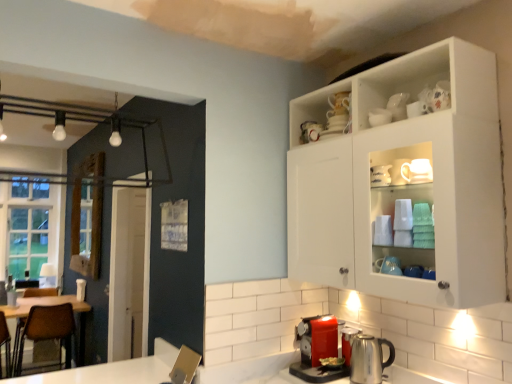
The width and height of the screenshot is (512, 384). I want to click on clear glass window at left, so click(31, 225).

Identify the location of metallic silver kettle at lower center. (369, 359).

What are the coordinates of `white ceramic mug at upper center, the 1th tableware from the left` in the screenshot? It's located at (379, 117).

At what (x,y) coordinates should I click in order to perform the action: click on white glossy cabinet at upper right. Please return your answer as a coordinate pair (x, y). Image resolution: width=512 pixels, height=384 pixels. Looking at the image, I should click on (409, 158).

This screenshot has width=512, height=384. What do you see at coordinates (47, 332) in the screenshot?
I see `brown leather chair at left` at bounding box center [47, 332].

At what (x,y) coordinates should I click in order to perform the action: click on clear glass window at left. Please return your answer as a coordinate pair (x, y). The width and height of the screenshot is (512, 384). Looking at the image, I should click on (31, 225).

In the scene shown: From the image's perspective, which one is positioned lower, brown leather chair at left or white glossy mug at upper center, the first tableware viewed from the right?

From the image's view, brown leather chair at left is below.

Is brown leather chair at left aimed at white glossy mug at upper center, arranged as the 1th tableware when viewed from the top?

No, brown leather chair at left is not facing towards white glossy mug at upper center, arranged as the 1th tableware when viewed from the top.

From a real-world perspective, who is located lower, brown leather chair at left or white glossy mug at upper center, arranged as the 2th tableware when viewed from the left?

brown leather chair at left.

Can you confirm if brown leather chair at left is taller than white glossy mug at upper center, the first tableware viewed from the right?

Indeed, brown leather chair at left has a greater height compared to white glossy mug at upper center, the first tableware viewed from the right.

Does point (399, 113) appear closer or farther from the camera than point (380, 348)?

Point (399, 113) appears to be closer to the viewer than point (380, 348).

Starting from the metallic silver kettle at lower center, which tableware is the 2nd one to the right? Please provide its 2D coordinates.

[(398, 106)]

Considering the sizes of objects white glossy mug at upper center, arranged as the 2th tableware when viewed from the left, and metallic silver kettle at lower center in the image provided, who is bigger, white glossy mug at upper center, arranged as the 2th tableware when viewed from the left, or metallic silver kettle at lower center?

metallic silver kettle at lower center.

How different are the orientations of white glossy mug at upper center, the first tableware viewed from the right, and clear glass window at left in degrees?

The angle between the facing direction of white glossy mug at upper center, the first tableware viewed from the right, and the facing direction of clear glass window at left is 89.5 degrees.

Is the surface of white glossy mug at upper center, acting as the 2th tableware starting from the front, in direct contact with clear glass window at left?

No, white glossy mug at upper center, acting as the 2th tableware starting from the front, is not beside clear glass window at left.

Does white glossy mug at upper center, acting as the second tableware starting from the bottom, have a larger size compared to clear glass window at left?

No.

Is white glossy mug at upper center, acting as the second tableware starting from the bottom, taller or shorter than clear glass window at left?

In the image, white glossy mug at upper center, acting as the second tableware starting from the bottom, appears to be shorter than clear glass window at left.

Do you think white ceramic mug at upper center, the 1th tableware when ordered from front to back, is within white glossy cabinet at upper right, or outside of it?

white ceramic mug at upper center, the 1th tableware when ordered from front to back, is located inside white glossy cabinet at upper right.

Based on the photo, from a real-world perspective, which is physically below, white ceramic mug at upper center, the 1th tableware when ordered from front to back, or white glossy cabinet at upper right?

white glossy cabinet at upper right.

Does white ceramic mug at upper center, marked as the 1th tableware in a bottom-to-top arrangement, turn towards white glossy cabinet at upper right?

Yes, white ceramic mug at upper center, marked as the 1th tableware in a bottom-to-top arrangement, faces towards white glossy cabinet at upper right.

From the image's perspective, which one is positioned higher, white glossy cabinet at upper right or brown leather chair at left?

→ white glossy cabinet at upper right is shown above in the image.

Is white glossy cabinet at upper right smaller than brown leather chair at left?

No, white glossy cabinet at upper right is not smaller than brown leather chair at left.

From a real-world perspective, is white glossy cabinet at upper right physically above brown leather chair at left?

Indeed, from a real-world perspective, white glossy cabinet at upper right stands above brown leather chair at left.

Considering the relative positions of white glossy mug at upper center, the first tableware viewed from the right, and brown leather chair at left in the image provided, is white glossy mug at upper center, the first tableware viewed from the right, behind brown leather chair at left?

No.

Between white glossy mug at upper center, arranged as the 2th tableware when viewed from the left, and brown leather chair at left, which one appears on the right side from the viewer's perspective?

Positioned to the right is white glossy mug at upper center, arranged as the 2th tableware when viewed from the left.

From the image's perspective, is white glossy mug at upper center, acting as the second tableware starting from the bottom, under brown leather chair at left?

Incorrect, from the image's perspective, white glossy mug at upper center, acting as the second tableware starting from the bottom, is higher than brown leather chair at left.

How much distance is there between white glossy mug at upper center, which is counted as the 1th tableware, starting from the back, and brown leather chair at left?

A distance of 11.22 feet exists between white glossy mug at upper center, which is counted as the 1th tableware, starting from the back, and brown leather chair at left.

Considering the sizes of metallic silver kettle at lower center and white glossy mug at upper center, which is counted as the 1th tableware, starting from the back, in the image, is metallic silver kettle at lower center wider or thinner than white glossy mug at upper center, which is counted as the 1th tableware, starting from the back,?

Clearly, metallic silver kettle at lower center has more width compared to white glossy mug at upper center, which is counted as the 1th tableware, starting from the back.

Which is closer, (377, 381) or (402, 115)?

Point (377, 381).

Which object is positioned more to the right, metallic silver kettle at lower center or white glossy mug at upper center, acting as the 2th tableware starting from the front?

white glossy mug at upper center, acting as the 2th tableware starting from the front, is more to the right.

Is metallic silver kettle at lower center surrounding white glossy mug at upper center, arranged as the 1th tableware when viewed from the top?

No, white glossy mug at upper center, arranged as the 1th tableware when viewed from the top, is not inside metallic silver kettle at lower center.

This screenshot has height=384, width=512. In order to click on chair on the left of white glossy mug at upper center, arranged as the 1th tableware when viewed from the top in this screenshot , I will do (x=47, y=332).

This screenshot has height=384, width=512. In order to click on tableware that is the 2nd object located above the metallic silver kettle at lower center (from the image's perspective) in this screenshot , I will do `click(398, 106)`.

From the image, which object appears to be farther from white ceramic mug at upper center, acting as the second tableware starting from the right, white glossy cabinet at upper right or clear glass window at left?

Based on the image, clear glass window at left appears to be further to white ceramic mug at upper center, acting as the second tableware starting from the right.

Which object lies further to the anchor point white ceramic mug at upper center, the 1th tableware when ordered from front to back, brown leather chair at left or white glossy cabinet at upper right?

brown leather chair at left.

When comparing their distances from white glossy mug at upper center, acting as the second tableware starting from the bottom, does brown leather chair at left or metallic silver kettle at lower center seem further?

brown leather chair at left is further to white glossy mug at upper center, acting as the second tableware starting from the bottom.

Looking at this image, when comparing their distances from brown leather chair at left, does white glossy cabinet at upper right or white ceramic mug at upper center, marked as the 1th tableware in a bottom-to-top arrangement, seem closer?

white glossy cabinet at upper right.

From the image, which object appears to be farther from white glossy cabinet at upper right, clear glass window at left or metallic silver kettle at lower center?

clear glass window at left is further to white glossy cabinet at upper right.

When comparing their distances from metallic silver kettle at lower center, does brown leather chair at left or white glossy cabinet at upper right seem further?

brown leather chair at left.

When comparing their distances from clear glass window at left, does metallic silver kettle at lower center or white glossy cabinet at upper right seem further?

metallic silver kettle at lower center.

Looking at the image, which one is located closer to white glossy mug at upper center, arranged as the 2th tableware when viewed from the left, white glossy cabinet at upper right or clear glass window at left?

white glossy cabinet at upper right is closer to white glossy mug at upper center, arranged as the 2th tableware when viewed from the left.

The height and width of the screenshot is (384, 512). Find the location of `appliance between brown leather chair at left and white ceramic mug at upper center, the 1th tableware when ordered from front to back, in the horizontal direction`. appliance between brown leather chair at left and white ceramic mug at upper center, the 1th tableware when ordered from front to back, in the horizontal direction is located at coordinates (369, 359).

Identify the location of tableware between white glossy mug at upper center, arranged as the 2th tableware when viewed from the left, and metallic silver kettle at lower center vertically. (379, 117).

The image size is (512, 384). What are the coordinates of `appliance situated between clear glass window at left and white ceramic mug at upper center, the 1th tableware from the left, from left to right` in the screenshot? It's located at (369, 359).

At what (x,y) coordinates should I click in order to perform the action: click on tableware between white glossy cabinet at upper right and white glossy mug at upper center, arranged as the 2th tableware when viewed from the left, from front to back. Please return your answer as a coordinate pair (x, y). The width and height of the screenshot is (512, 384). Looking at the image, I should click on (379, 117).